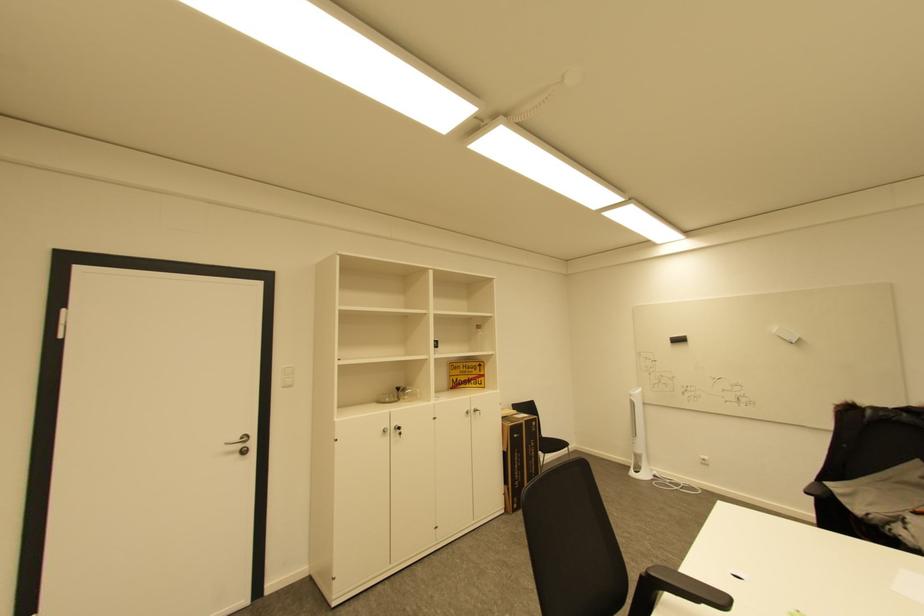
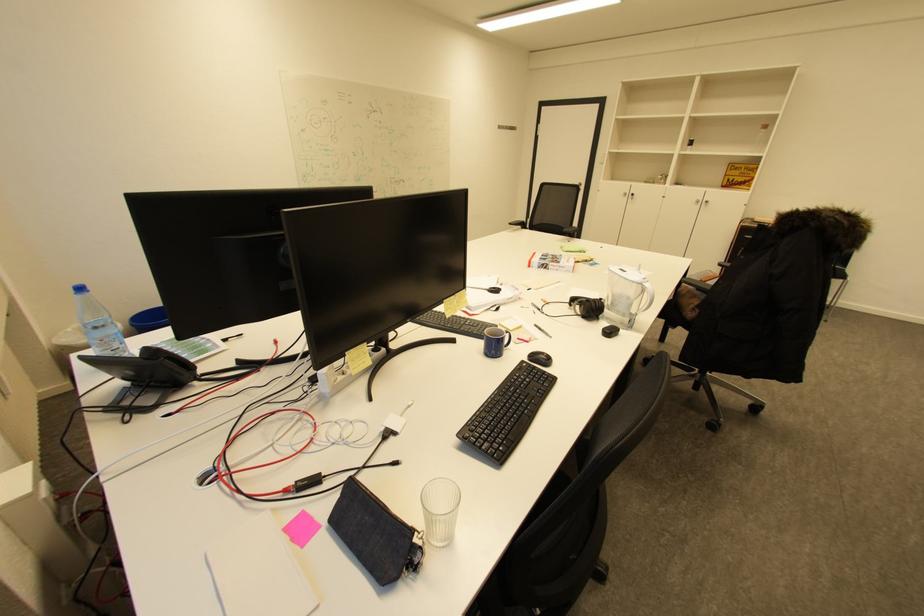
Where in the second image is the point corresponding to point 473,413 from the first image?

(703, 201)